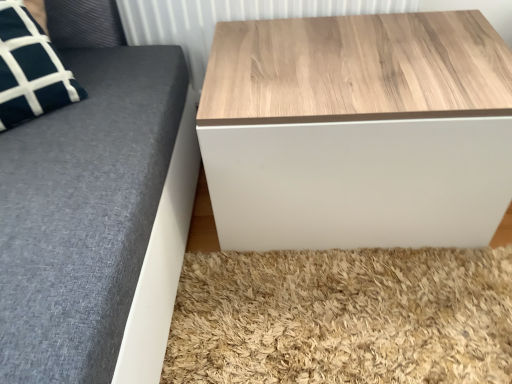
Find the location of `empty space that is ontop of wooden/textured table at upper right (from a real-world perspective)`. empty space that is ontop of wooden/textured table at upper right (from a real-world perspective) is located at coordinates (374, 57).